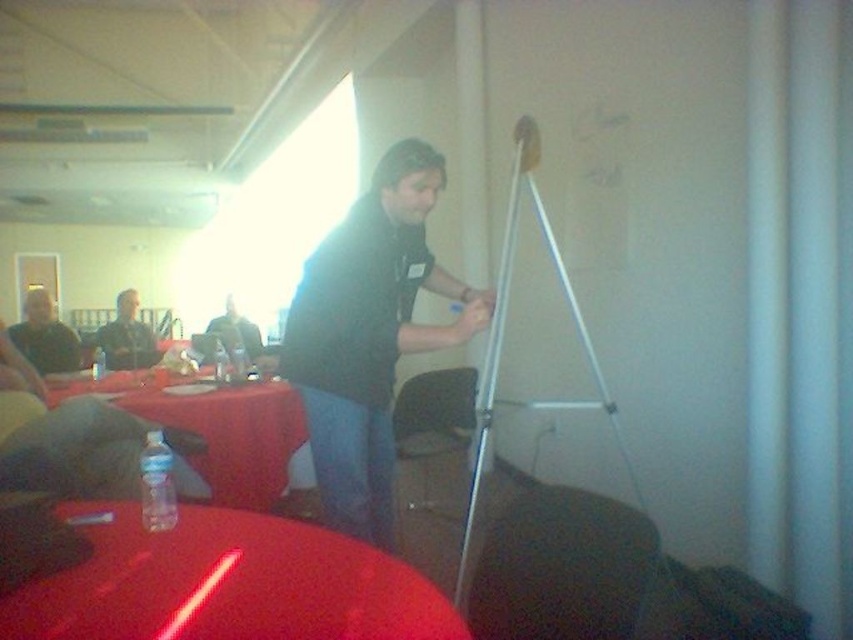
Who is higher up, metallic silver tripod at right or matte black shirt at upper left?

matte black shirt at upper left is above.

Between metallic silver tripod at right and matte black shirt at upper left, which one appears on the left side from the viewer's perspective?

Positioned to the left is matte black shirt at upper left.

Which is behind, point (636, 476) or point (131, 307)?

Positioned behind is point (131, 307).

This screenshot has height=640, width=853. Find the location of `metallic silver tripod at right`. metallic silver tripod at right is located at coordinates (502, 342).

From the picture: Between translucent plastic bottle at lower left and matte black shirt at left, which one has more height?

translucent plastic bottle at lower left

Based on the photo, measure the distance between point (178, 406) and camera.

The distance of point (178, 406) from camera is 10.17 feet.

Who is more distant from viewer, (157,419) or (44,348)?

The point (44,348) is more distant.

What are the coordinates of `translucent plastic bottle at lower left` in the screenshot? It's located at (219, 429).

Is black matte shirt at center below matte black shirt at upper left?

Yes.

Is point (321, 294) less distant than point (126, 314)?

Yes, point (321, 294) is in front of point (126, 314).

Where is `black matte shirt at center`? This screenshot has height=640, width=853. black matte shirt at center is located at coordinates (369, 333).